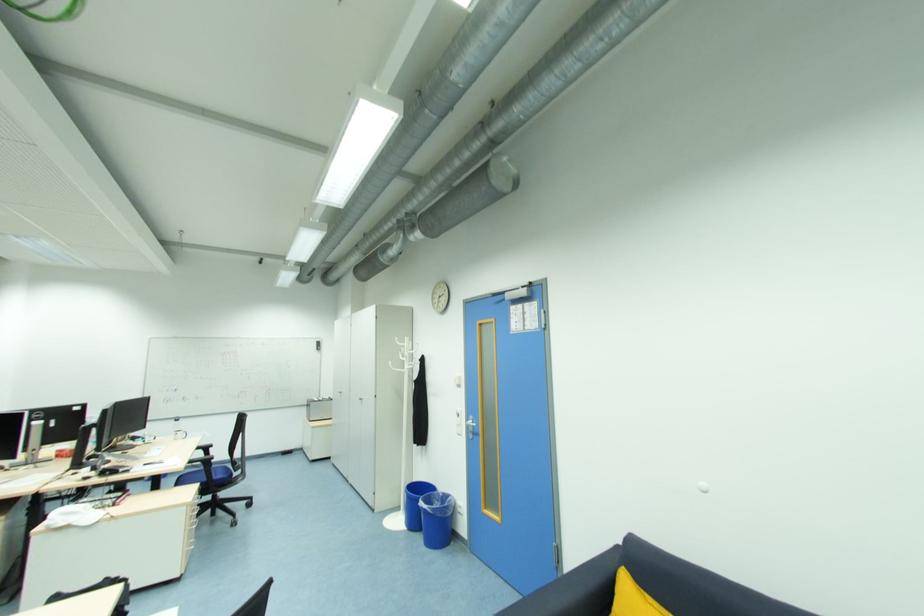
At what (x,y) coordinates should I click in order to perform the action: click on dark sofa seat. Please return your answer as a coordinate pair (x, y). The image size is (924, 616). Looking at the image, I should click on (693, 585).